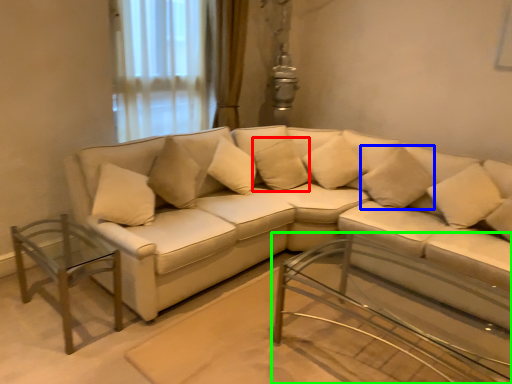
Question: Which object is the farthest from pillow (highlighted by a red box)? Choose among these: pillow (highlighted by a blue box) or table (highlighted by a green box).

Choices:
 (A) pillow
 (B) table

Answer: (B)